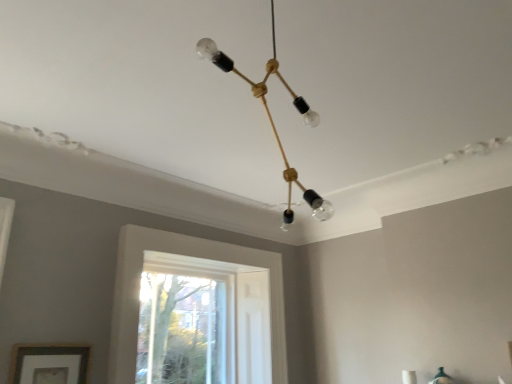
Question: Considering the relative sizes of clear glass bulb at center and clear glass window at center in the image provided, is clear glass bulb at center bigger than clear glass window at center?

Choices:
 (A) no
 (B) yes

Answer: (B)

Question: Is clear glass bulb at center at the left side of clear glass window at center?

Choices:
 (A) yes
 (B) no

Answer: (B)

Question: Does clear glass bulb at center have a lesser width compared to clear glass window at center?

Choices:
 (A) yes
 (B) no

Answer: (B)

Question: Could you tell me if clear glass bulb at center is facing clear glass window at center?

Choices:
 (A) yes
 (B) no

Answer: (B)

Question: Considering the relative positions of clear glass bulb at center and clear glass window at center in the image provided, is clear glass bulb at center to the right of clear glass window at center from the viewer's perspective?

Choices:
 (A) no
 (B) yes

Answer: (B)

Question: Looking at the image, does wooden picture frame at lower left seem bigger or smaller compared to clear glass bulb at center?

Choices:
 (A) small
 (B) big

Answer: (A)

Question: In the image, is wooden picture frame at lower left positioned in front of or behind clear glass bulb at center?

Choices:
 (A) behind
 (B) front

Answer: (A)

Question: In terms of height, does wooden picture frame at lower left look taller or shorter compared to clear glass bulb at center?

Choices:
 (A) short
 (B) tall

Answer: (A)

Question: From the image's perspective, is wooden picture frame at lower left positioned above or below clear glass bulb at center?

Choices:
 (A) above
 (B) below

Answer: (B)

Question: Is clear glass window at center bigger or smaller than clear glass bulb at center?

Choices:
 (A) small
 (B) big

Answer: (A)

Question: Is clear glass window at center to the left or to the right of clear glass bulb at center in the image?

Choices:
 (A) right
 (B) left

Answer: (B)

Question: From a real-world perspective, relative to clear glass bulb at center, is clear glass window at center vertically above or below?

Choices:
 (A) below
 (B) above

Answer: (A)

Question: From the image's perspective, is clear glass window at center above or below clear glass bulb at center?

Choices:
 (A) below
 (B) above

Answer: (A)

Question: In terms of height, does clear glass bulb at center look taller or shorter compared to clear glass window at center?

Choices:
 (A) short
 (B) tall

Answer: (A)

Question: From the image's perspective, is clear glass bulb at center positioned above or below clear glass window at center?

Choices:
 (A) above
 (B) below

Answer: (A)